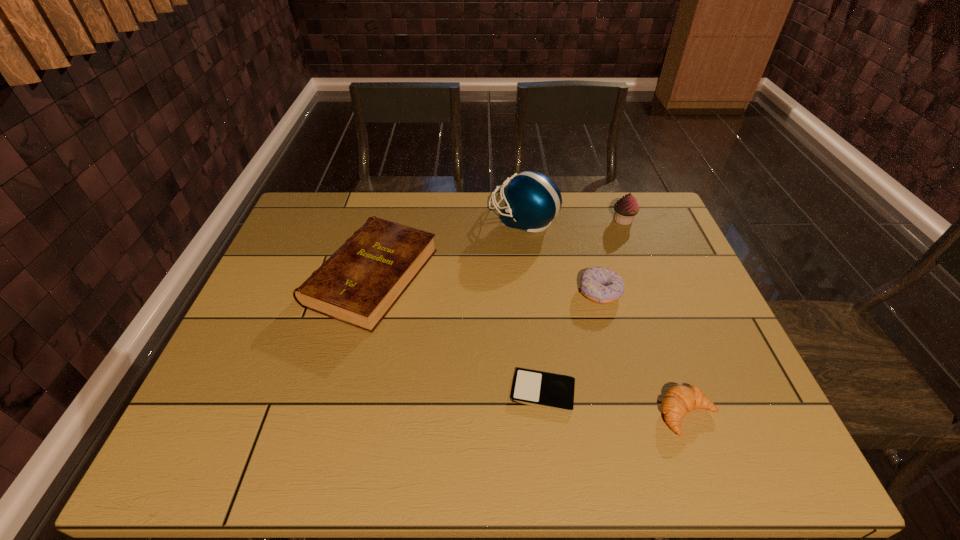
Find the location of `cupcake at the right edge`. cupcake at the right edge is located at coordinates (626, 208).

Identify the location of crescent roll positioned at the right edge. This screenshot has height=540, width=960. (680, 399).

The height and width of the screenshot is (540, 960). Find the location of `object that is at the far left corner`. object that is at the far left corner is located at coordinates (359, 284).

Identify the location of object positioned at the far right corner. The width and height of the screenshot is (960, 540). point(626,208).

Image resolution: width=960 pixels, height=540 pixels. What are the coordinates of `object that is positioned at the near right corner` in the screenshot? It's located at (680, 399).

At what (x,y) coordinates should I click in order to perform the action: click on free spot at the far edge of the desktop. Please return your answer as a coordinate pair (x, y). This screenshot has height=540, width=960. Looking at the image, I should click on [x=550, y=235].

Locate an element on the screen. The width and height of the screenshot is (960, 540). vacant region at the near edge is located at coordinates (651, 450).

In the image, there is a desktop. At what (x,y) coordinates should I click in order to perform the action: click on vacant space at the left edge. Please return your answer as a coordinate pair (x, y). This screenshot has width=960, height=540. Looking at the image, I should click on (286, 345).

The height and width of the screenshot is (540, 960). In order to click on vacant region at the right edge of the desktop in this screenshot , I will do `click(659, 284)`.

You are a GUI agent. You are given a task and a screenshot of the screen. Output one action in this format:
    pyautogui.click(x=<x>, y=<y>)
    Task: Click on the free space at the far left corner
    The height and width of the screenshot is (540, 960).
    Given the screenshot: What is the action you would take?
    pyautogui.click(x=335, y=218)